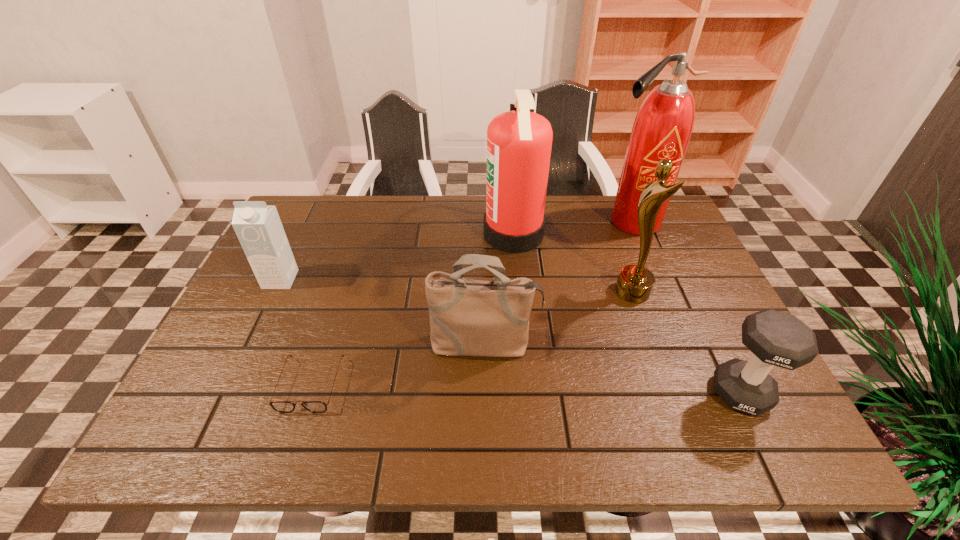
Where is `free location located 0.330m at the nozzle of the left fire extinguisher`? This screenshot has height=540, width=960. free location located 0.330m at the nozzle of the left fire extinguisher is located at coordinates (372, 234).

Where is `free location located 0.070m at the nozzle of the left fire extinguisher`? free location located 0.070m at the nozzle of the left fire extinguisher is located at coordinates (460, 234).

Find the location of a particular element. This screenshot has height=540, width=960. vacant space located on the front-facing side of the award is located at coordinates (588, 292).

Find the location of a particular element. vacant area situated 0.110m on the front-facing side of the award is located at coordinates (572, 292).

The height and width of the screenshot is (540, 960). Find the location of `blank space located on the front-facing side of the award`. blank space located on the front-facing side of the award is located at coordinates (470, 292).

Locate an element on the screen. free point located on the front-facing side of the shoulder bag is located at coordinates pyautogui.click(x=485, y=401).

Identify the location of free space located on the front label of the carton. The image size is (960, 540). (227, 392).

Where is `vacant space located on the front of the dumbbell`? vacant space located on the front of the dumbbell is located at coordinates (768, 449).

I want to click on free region located on the front-facing side of the sunglasses, so click(x=293, y=442).

I want to click on dumbbell located in the near edge section of the desktop, so click(776, 338).